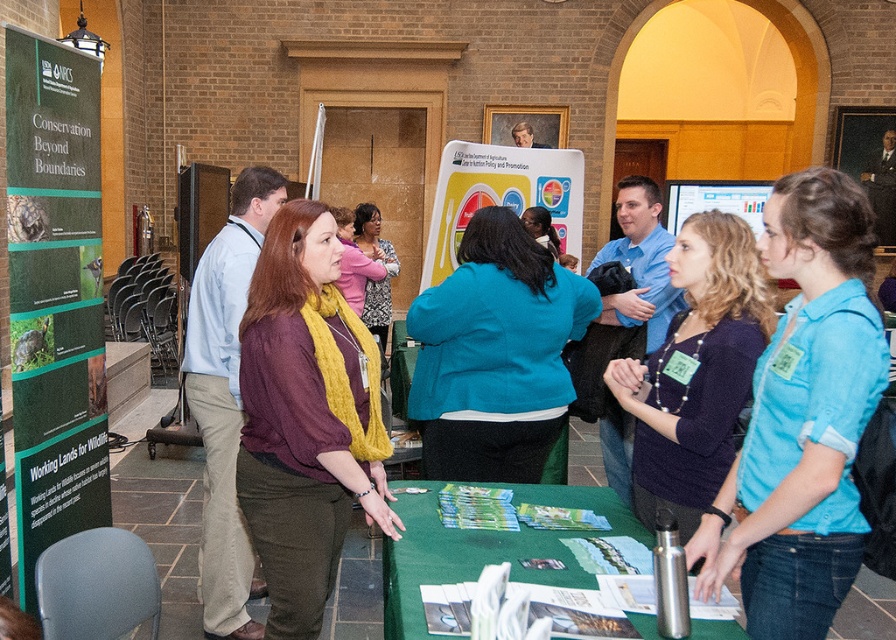
Does maroon knit sweater at center appear over teal woolen jacket at center?

Incorrect, maroon knit sweater at center is not positioned above teal woolen jacket at center.

Which is above, maroon knit sweater at center or teal woolen jacket at center?

teal woolen jacket at center is above.

This screenshot has height=640, width=896. Describe the element at coordinates (306, 417) in the screenshot. I see `maroon knit sweater at center` at that location.

Locate an element on the screen. maroon knit sweater at center is located at coordinates (306, 417).

Is point (813, 310) positioned behind point (475, 401)?

No, (813, 310) is in front of (475, 401).

Is blue shirt at center taller than teal woolen jacket at center?

Indeed, blue shirt at center has a greater height compared to teal woolen jacket at center.

Who is more distant from viewer, (x=797, y=586) or (x=506, y=275)?

The point (x=506, y=275) is behind.

Identify the location of blue shirt at center. (802, 419).

Can you confirm if blue shirt at center is wider than green fabric table at center?

Incorrect, blue shirt at center's width does not surpass green fabric table at center's.

Who is higher up, blue shirt at center or green fabric table at center?

blue shirt at center is higher up.

The height and width of the screenshot is (640, 896). Find the location of `blue shirt at center`. blue shirt at center is located at coordinates (802, 419).